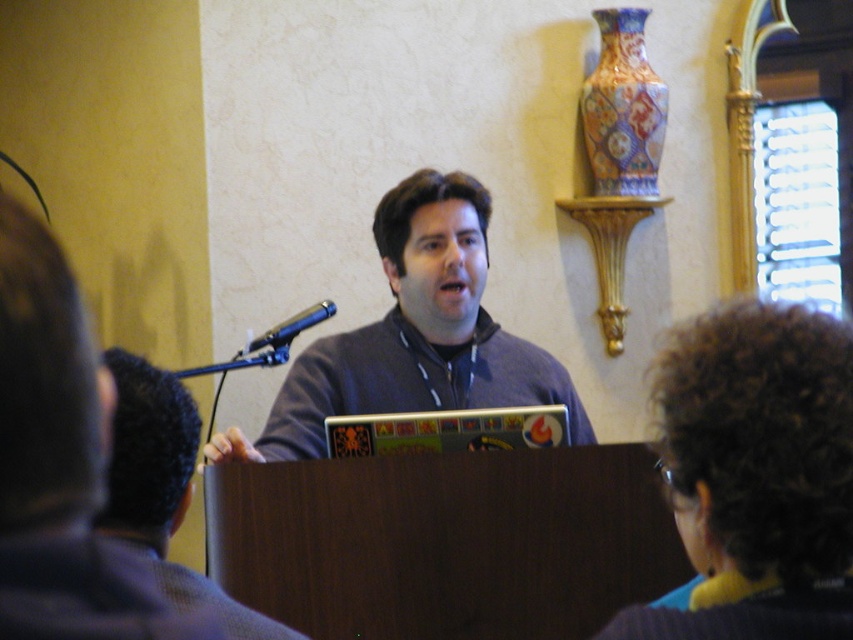
Which is behind, point (729, 369) or point (164, 413)?

The point (164, 413) is behind.

Can you confirm if curly hair at upper right is positioned below gray fabric shirt at center?

No.

Locate an element on the screen. The image size is (853, 640). curly hair at upper right is located at coordinates (756, 474).

You are a GUI agent. You are given a task and a screenshot of the screen. Output one action in this format:
    pyautogui.click(x=<x>, y=<y>)
    Task: Click on the curly hair at upper right
    
    Given the screenshot: What is the action you would take?
    pyautogui.click(x=756, y=474)

Which of these two, curly hair at upper right or dark gray hoodie at center, stands taller?

Standing taller between the two is curly hair at upper right.

Identify the location of curly hair at upper right. This screenshot has height=640, width=853. (756, 474).

The image size is (853, 640). What are the coordinates of `curly hair at upper right` in the screenshot? It's located at (756, 474).

What do you see at coordinates (756, 474) in the screenshot? The width and height of the screenshot is (853, 640). I see `curly hair at upper right` at bounding box center [756, 474].

Looking at this image, who is more distant from viewer, (805, 508) or (280, 332)?

Positioned behind is point (280, 332).

The height and width of the screenshot is (640, 853). What are the coordinates of `curly hair at upper right` in the screenshot? It's located at (756, 474).